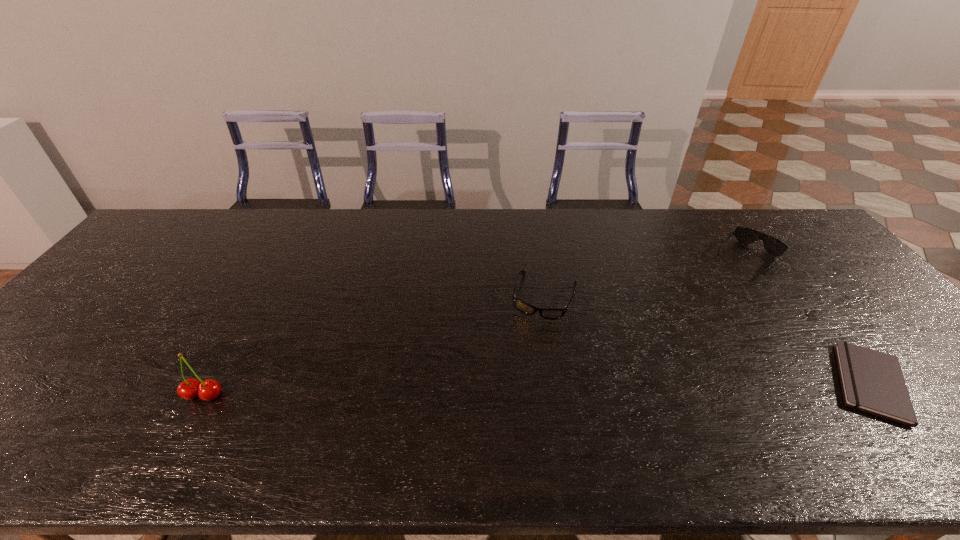
In order to click on blank space at the far left corner of the desktop in this screenshot , I will do `click(156, 227)`.

The width and height of the screenshot is (960, 540). I want to click on vacant space at the far right corner of the desktop, so point(784,238).

Where is `vacant position at the near right corner of the desktop`? Image resolution: width=960 pixels, height=540 pixels. vacant position at the near right corner of the desktop is located at coordinates (957, 404).

This screenshot has height=540, width=960. I want to click on blank region between the leftmost object and the spectacles, so click(x=374, y=346).

Identify the location of vacant region between the spectacles and the checkbook. (708, 340).

Identify the location of vacant space that is in between the spectacles and the leftmost object. (374, 346).

This screenshot has height=540, width=960. I want to click on unoccupied area between the sunglasses and the leftmost object, so click(x=475, y=327).

Locate an element on the screen. The height and width of the screenshot is (540, 960). free space between the spectacles and the shortest object is located at coordinates (708, 340).

This screenshot has width=960, height=540. Identify the location of free space between the third object from right to left and the cherry. (374, 346).

Identify the location of vacant area that lies between the sunglasses and the cherry. (475, 327).